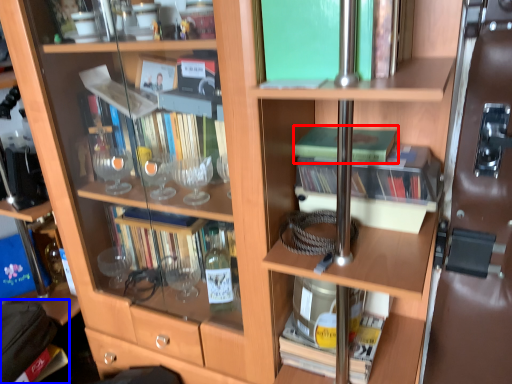
Question: Among these objects, which one is nearest to the camera, book (highlighted by a red box) or handbag (highlighted by a blue box)?

Choices:
 (A) book
 (B) handbag

Answer: (A)